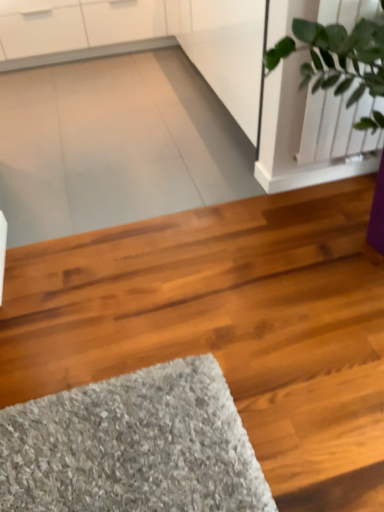
Question: Does green leafy plant at upper right have a larger size compared to shiny brown hardwood at center?

Choices:
 (A) no
 (B) yes

Answer: (A)

Question: Is green leafy plant at upper right wider than shiny brown hardwood at center?

Choices:
 (A) yes
 (B) no

Answer: (B)

Question: Is the position of green leafy plant at upper right more distant than that of shiny brown hardwood at center?

Choices:
 (A) yes
 (B) no

Answer: (A)

Question: Can you confirm if green leafy plant at upper right is positioned to the left of shiny brown hardwood at center?

Choices:
 (A) no
 (B) yes

Answer: (A)

Question: Is green leafy plant at upper right aimed at shiny brown hardwood at center?

Choices:
 (A) yes
 (B) no

Answer: (B)

Question: Does green leafy plant at upper right have a smaller size compared to shiny brown hardwood at center?

Choices:
 (A) yes
 (B) no

Answer: (A)

Question: Is shiny brown hardwood at center further to camera compared to green leafy plant at upper right?

Choices:
 (A) yes
 (B) no

Answer: (B)

Question: From the image's perspective, would you say shiny brown hardwood at center is positioned over green leafy plant at upper right?

Choices:
 (A) no
 (B) yes

Answer: (A)

Question: Considering the relative sizes of shiny brown hardwood at center and green leafy plant at upper right in the image provided, is shiny brown hardwood at center bigger than green leafy plant at upper right?

Choices:
 (A) no
 (B) yes

Answer: (B)

Question: Is shiny brown hardwood at center oriented away from green leafy plant at upper right?

Choices:
 (A) no
 (B) yes

Answer: (A)

Question: Is shiny brown hardwood at center at the right side of green leafy plant at upper right?

Choices:
 (A) no
 (B) yes

Answer: (A)

Question: From a real-world perspective, is shiny brown hardwood at center located beneath green leafy plant at upper right?

Choices:
 (A) yes
 (B) no

Answer: (A)

Question: Based on their sizes in the image, would you say shiny brown hardwood at center is bigger or smaller than green leafy plant at upper right?

Choices:
 (A) big
 (B) small

Answer: (A)